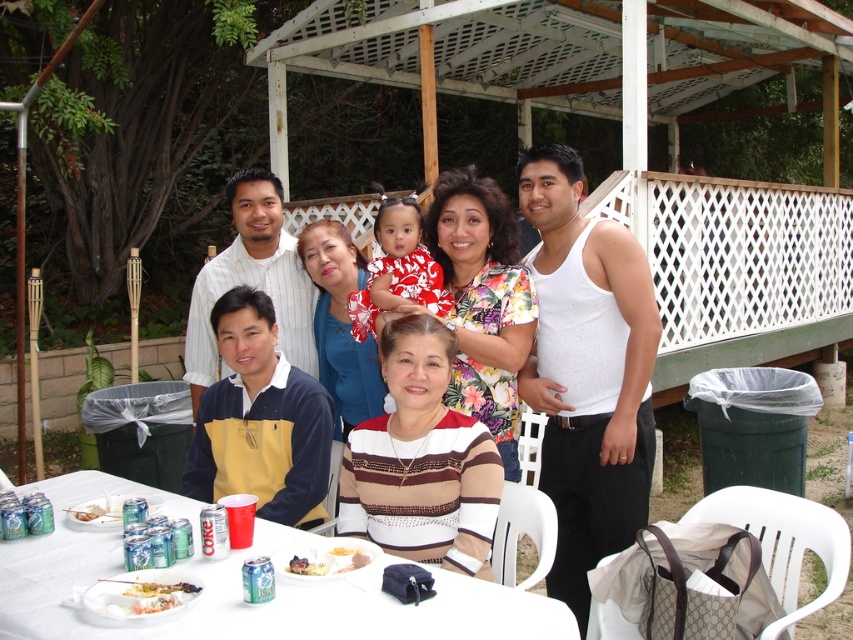
Question: Which of the following is the closest to the observer?

Choices:
 (A) white creamy dessert at lower center
 (B) printed fabric dress at center

Answer: (A)

Question: Which is farther from the white creamy dessert at lower center?

Choices:
 (A) white creamy cake at lower center
 (B) floral fabric dress at upper center

Answer: (B)

Question: Can you confirm if floral fabric dress at upper center is positioned to the right of white striped shirt at center?

Choices:
 (A) yes
 (B) no

Answer: (A)

Question: Is white plastic table at center thinner than white striped shirt at center?

Choices:
 (A) no
 (B) yes

Answer: (A)

Question: Can you confirm if floral fabric dress at upper center is smaller than printed fabric dress at center?

Choices:
 (A) yes
 (B) no

Answer: (B)

Question: Which point appears farthest from the camera in this image?

Choices:
 (A) (355, 554)
 (B) (322, 572)

Answer: (A)